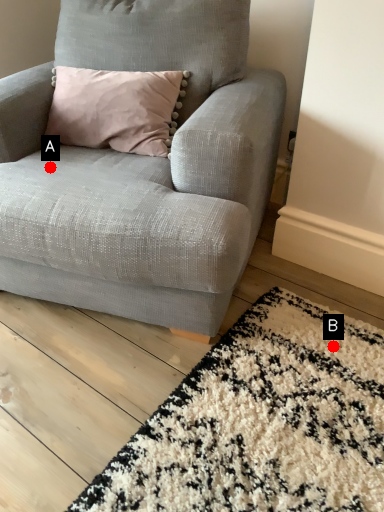
Question: Two points are circled on the image, labeled by A and B beside each circle. Which point is closer to the camera?

Choices:
 (A) A is closer
 (B) B is closer

Answer: (B)